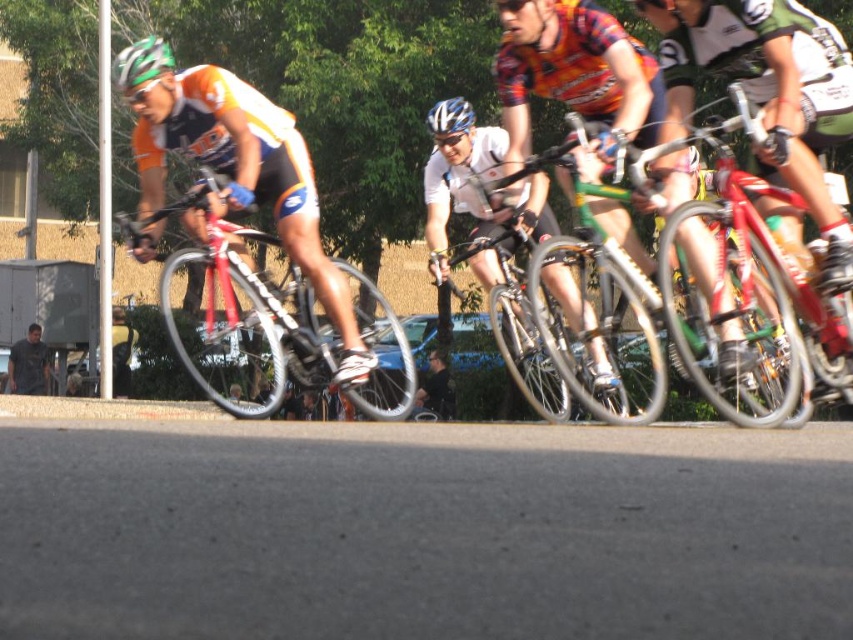
Consider the image. You are a photographer trying to capture a photo of the green matte bicycle at center and the blue glossy helmet at center. Which object should you focus on first if you want to ensure both are in sharp focus?

The green matte bicycle at center is positioned under the blue glossy helmet at center, so focusing on the blue glossy helmet at center first would help ensure both are in sharp focus since it is closer to the camera.

You are a photographer positioned at the starting line of the cycling race. You want to capture a photo of the green matte bicycle at center and the blue glossy helmet at center. Based on their positions, which object should you focus on first to ensure both are in frame?

The green matte bicycle at center is in front of the blue glossy helmet at center, so you should focus on the green matte bicycle at center first to ensure both are in frame.